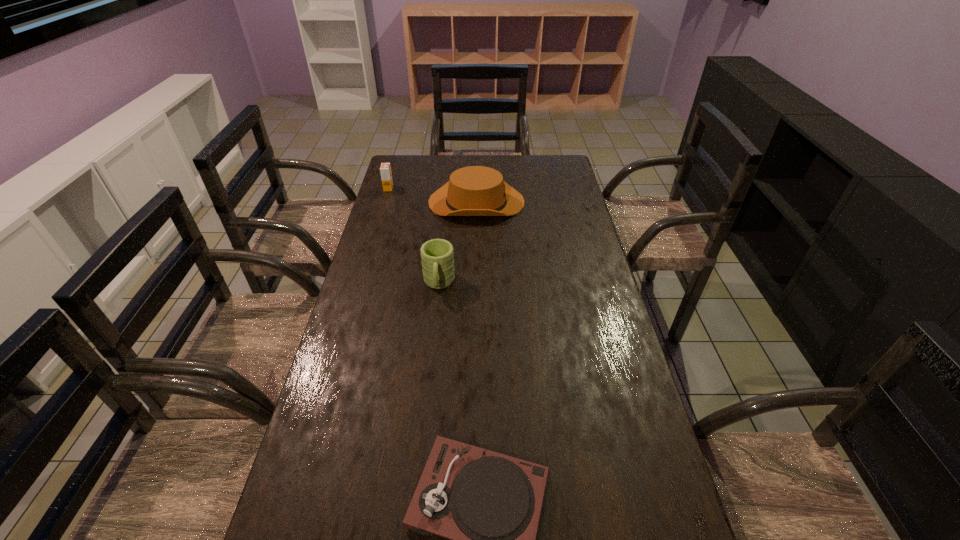
Where is `mug`? mug is located at coordinates (437, 255).

The width and height of the screenshot is (960, 540). I want to click on cowboy hat, so click(x=475, y=190).

Locate an element on the screen. Image resolution: width=960 pixels, height=540 pixels. the leftmost object is located at coordinates (385, 169).

The width and height of the screenshot is (960, 540). What are the coordinates of `free spot located on the side of the mug with the handle` in the screenshot? It's located at pyautogui.click(x=430, y=370).

This screenshot has height=540, width=960. I want to click on free space located on the front-facing side of the cowboy hat, so coord(574,202).

Where is `vacant region located on the front of the orange juice`? The height and width of the screenshot is (540, 960). vacant region located on the front of the orange juice is located at coordinates (379, 219).

Locate an element on the screen. This screenshot has width=960, height=540. object located at the left edge is located at coordinates (385, 169).

The image size is (960, 540). In the image, there is a desktop. Find the location of `vacant area at the far edge`. vacant area at the far edge is located at coordinates (515, 171).

You are a GUI agent. You are given a task and a screenshot of the screen. Output one action in this format:
    pyautogui.click(x=<x>, y=<y>)
    Task: Click on the vacant space at the left edge
    The height and width of the screenshot is (540, 960).
    Given the screenshot: What is the action you would take?
    [x=388, y=294]

Find the location of `free location at the right edge of the desktop`. free location at the right edge of the desktop is located at coordinates point(560,258).